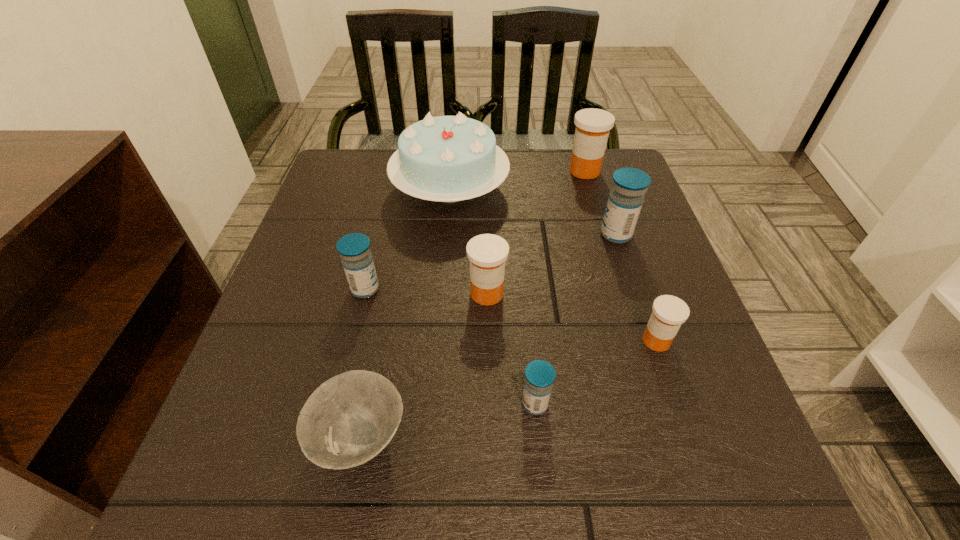
In order to click on the smallest blue medicine in this screenshot , I will do `click(539, 375)`.

Where is `the nearest medicine`? The width and height of the screenshot is (960, 540). the nearest medicine is located at coordinates pos(539,375).

Image resolution: width=960 pixels, height=540 pixels. I want to click on the third nearest object, so click(669, 312).

Identify the location of the smallest orange medicine. Image resolution: width=960 pixels, height=540 pixels. (669, 312).

Where is `the shortest object`? This screenshot has height=540, width=960. the shortest object is located at coordinates (347, 421).

The height and width of the screenshot is (540, 960). Find the location of `free point located on the right of the blue birthday cake`. free point located on the right of the blue birthday cake is located at coordinates (537, 191).

Where is `free point located on the label of the biggest orange medicine`? The width and height of the screenshot is (960, 540). free point located on the label of the biggest orange medicine is located at coordinates (461, 171).

The image size is (960, 540). Identify the location of vacant region located 0.250m on the label of the biggest orange medicine. (471, 171).

Where is `vacant space located on the label of the biggest orange medicine`? The image size is (960, 540). vacant space located on the label of the biggest orange medicine is located at coordinates (510, 171).

Locate an element on the screen. This screenshot has width=960, height=540. free region located on the front of the farthest blue medicine is located at coordinates (639, 306).